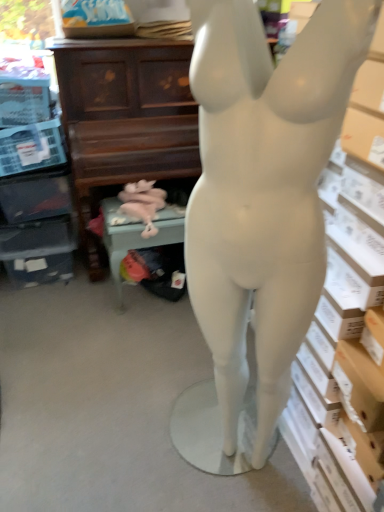
Question: Does matte brown piano at upper center appear on the left side of green fabric chair at lower center?

Choices:
 (A) yes
 (B) no

Answer: (A)

Question: Are matte brown piano at upper center and green fabric chair at lower center far apart?

Choices:
 (A) yes
 (B) no

Answer: (B)

Question: Considering the relative sizes of matte brown piano at upper center and green fabric chair at lower center in the image provided, is matte brown piano at upper center taller than green fabric chair at lower center?

Choices:
 (A) no
 (B) yes

Answer: (B)

Question: From the image's perspective, is matte brown piano at upper center under green fabric chair at lower center?

Choices:
 (A) yes
 (B) no

Answer: (B)

Question: From the image's perspective, does matte brown piano at upper center appear higher than green fabric chair at lower center?

Choices:
 (A) yes
 (B) no

Answer: (A)

Question: In terms of size, does pink fabric stuffed animal at lower center appear bigger or smaller than matte brown piano at upper center?

Choices:
 (A) big
 (B) small

Answer: (B)

Question: From a real-world perspective, is pink fabric stuffed animal at lower center above or below matte brown piano at upper center?

Choices:
 (A) above
 (B) below

Answer: (B)

Question: Is pink fabric stuffed animal at lower center taller or shorter than matte brown piano at upper center?

Choices:
 (A) short
 (B) tall

Answer: (A)

Question: Considering the positions of pink fabric stuffed animal at lower center and matte brown piano at upper center in the image, is pink fabric stuffed animal at lower center wider or thinner than matte brown piano at upper center?

Choices:
 (A) thin
 (B) wide

Answer: (A)

Question: Is green fabric chair at lower center in front of or behind pink fabric stuffed animal at lower center in the image?

Choices:
 (A) behind
 (B) front

Answer: (A)

Question: Considering the positions of green fabric chair at lower center and pink fabric stuffed animal at lower center in the image, is green fabric chair at lower center wider or thinner than pink fabric stuffed animal at lower center?

Choices:
 (A) thin
 (B) wide

Answer: (B)

Question: From a real-world perspective, is green fabric chair at lower center physically located above or below pink fabric stuffed animal at lower center?

Choices:
 (A) above
 (B) below

Answer: (B)

Question: Considering the positions of point (180, 241) and point (124, 189), is point (180, 241) closer or farther from the camera than point (124, 189)?

Choices:
 (A) closer
 (B) farther

Answer: (A)

Question: Considering the relative positions of pink fabric stuffed animal at lower center and green fabric chair at lower center in the image provided, is pink fabric stuffed animal at lower center to the left or to the right of green fabric chair at lower center?

Choices:
 (A) left
 (B) right

Answer: (A)

Question: Is pink fabric stuffed animal at lower center bigger or smaller than green fabric chair at lower center?

Choices:
 (A) small
 (B) big

Answer: (A)